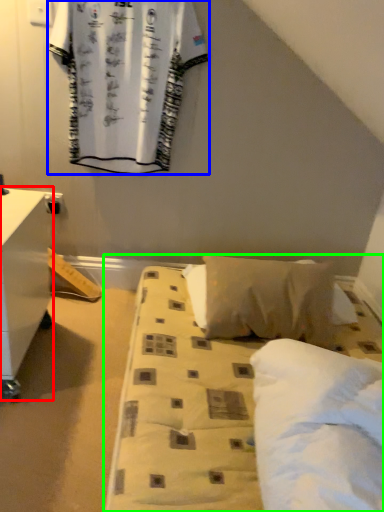
Question: Considering the real-world distances, which object is closest to nightstand (highlighted by a red box)? curtain (highlighted by a blue box) or bed (highlighted by a green box).

Choices:
 (A) curtain
 (B) bed

Answer: (B)